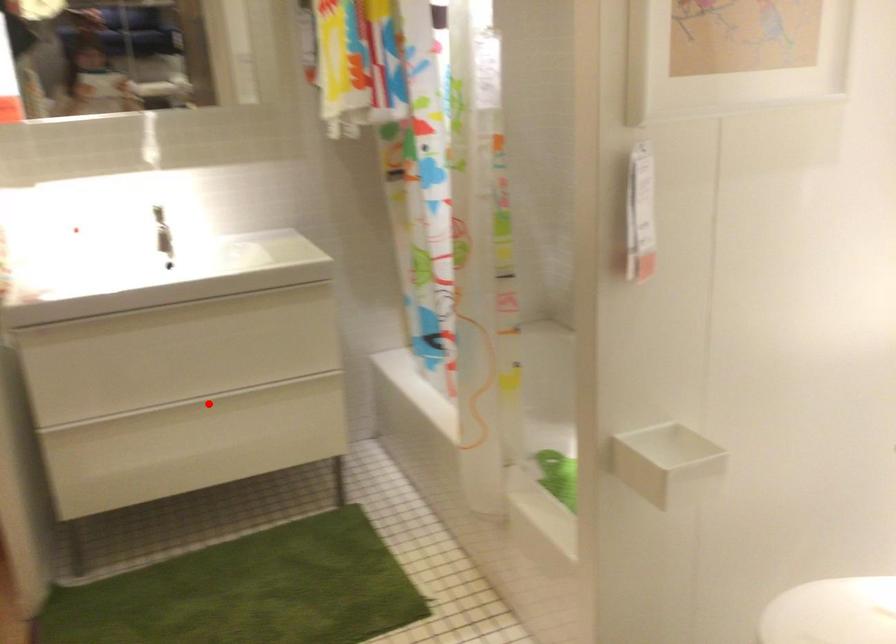
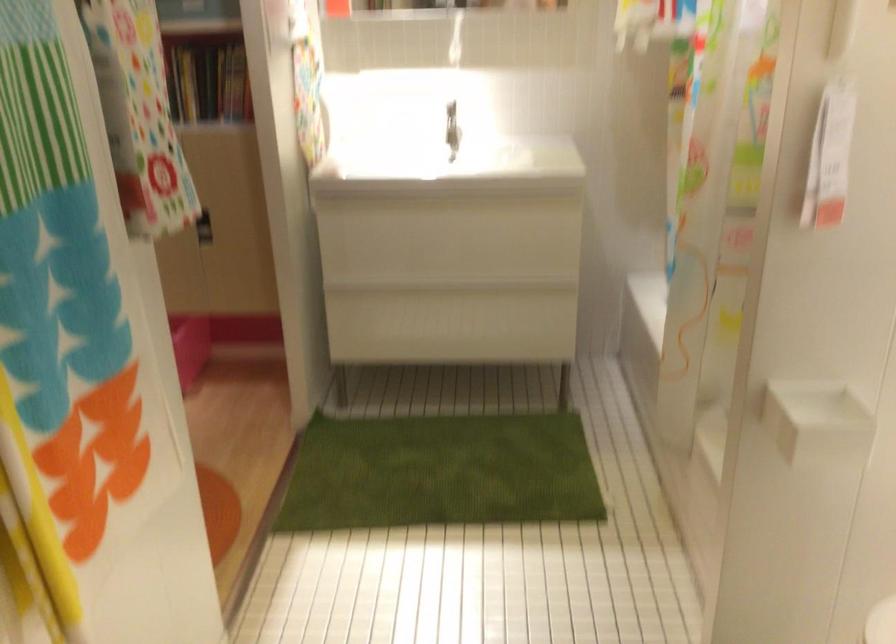
Question: I am providing you with two images of the same scene from different viewpoints. A red point is marked on the first image. At the location where the point appears in image 1, is it still visible in image 2?

Choices:
 (A) Yes
 (B) No

Answer: (A)